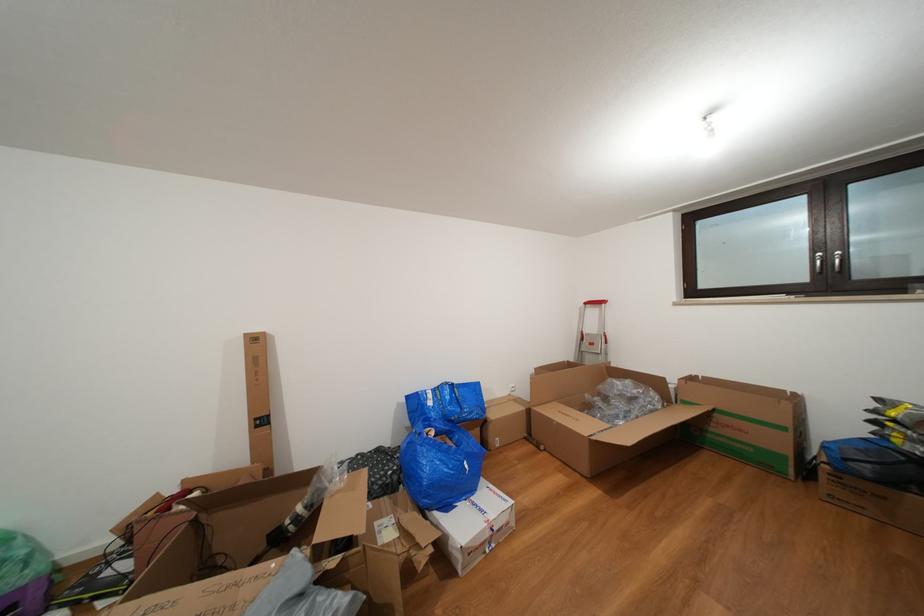
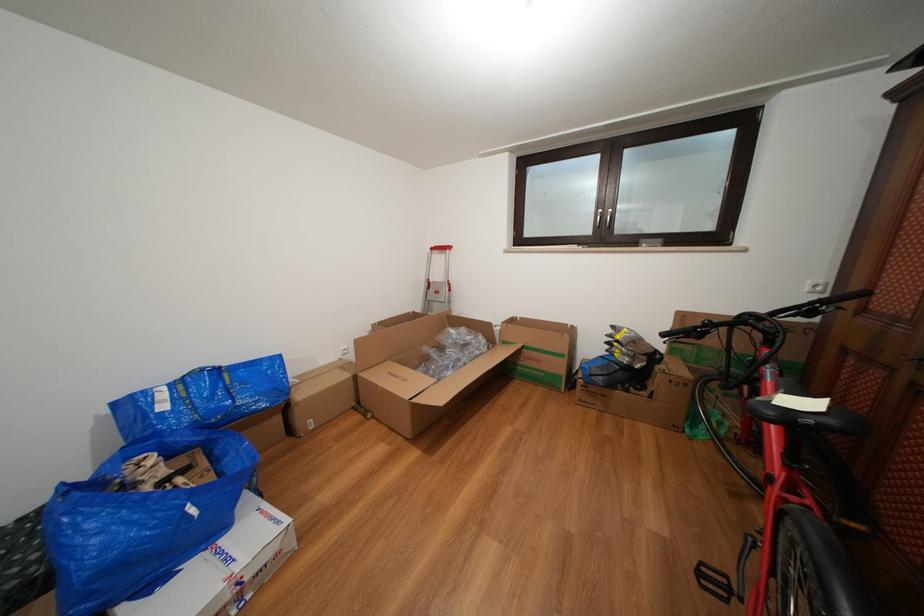
Locate, in the second image, the point that corresponds to pixel 821 257 in the first image.

(605, 214)